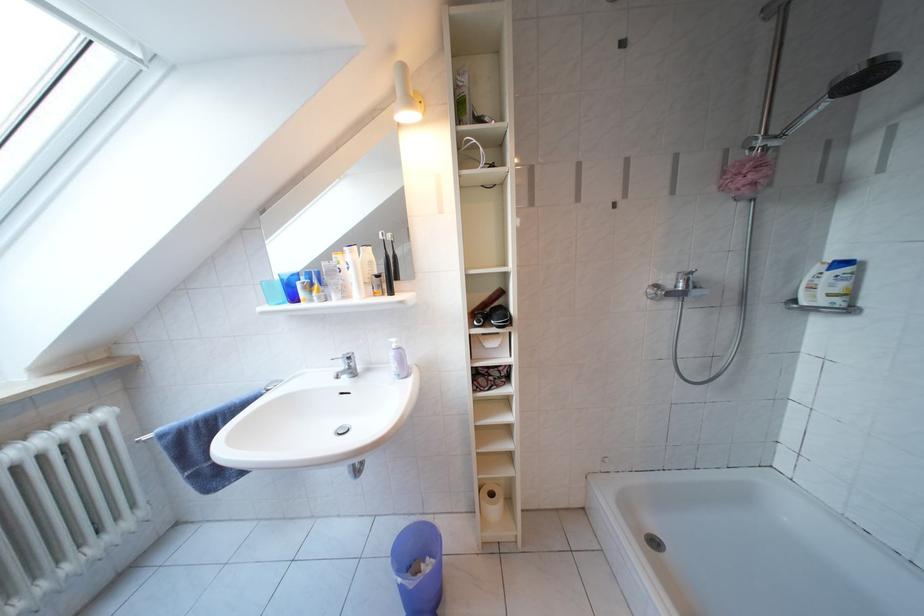
At what (x,y) coordinates should I click in order to perform the action: click on soap dispenser pump. Please return your answer as a coordinate pair (x, y). This screenshot has height=616, width=924. Looking at the image, I should click on (396, 342).